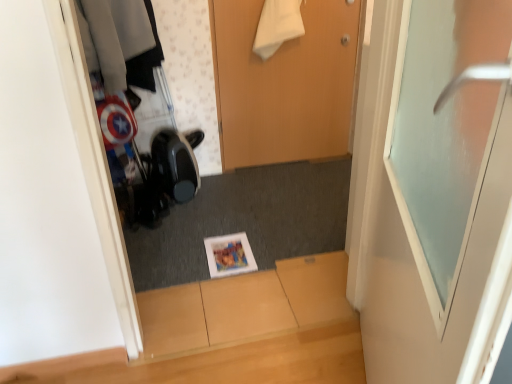
The height and width of the screenshot is (384, 512). In order to click on empty space that is to the right of matte paper magazine at center in this screenshot , I will do `click(280, 251)`.